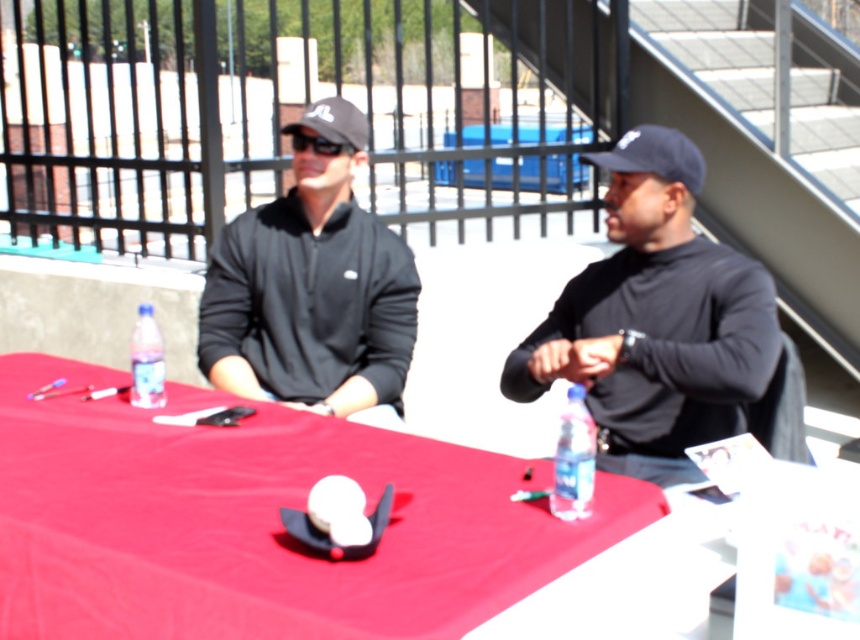
You are a photographer standing at the camera position. You want to take a closeup photo of the black matte baseball cap at center. Can you reach it with your hand without moving from your current position?

The black matte baseball cap at center is 2.91 meters away from camera, so you cannot reach it with your hand without moving from your current position.

Consider the image. You are a photographer at the event and need to place a small prop exactly 0.05 units to the right and 0.05 units above the black matte baseball cap at center. What coordinates should you use for the new prop?

The new coordinates would be calculated by adding 0.05 to the x and y values of the black matte baseball cap at center. Original position is at (x=333, y=122). Adding 0.05 to each gives 0.241 and 0.438. So the new coordinates are (x=376, y=154).

What is the significance of the point at coordinates (260, 524) in the image?

The point at coordinates (260, 524) marks the location of the red fabric table at center.